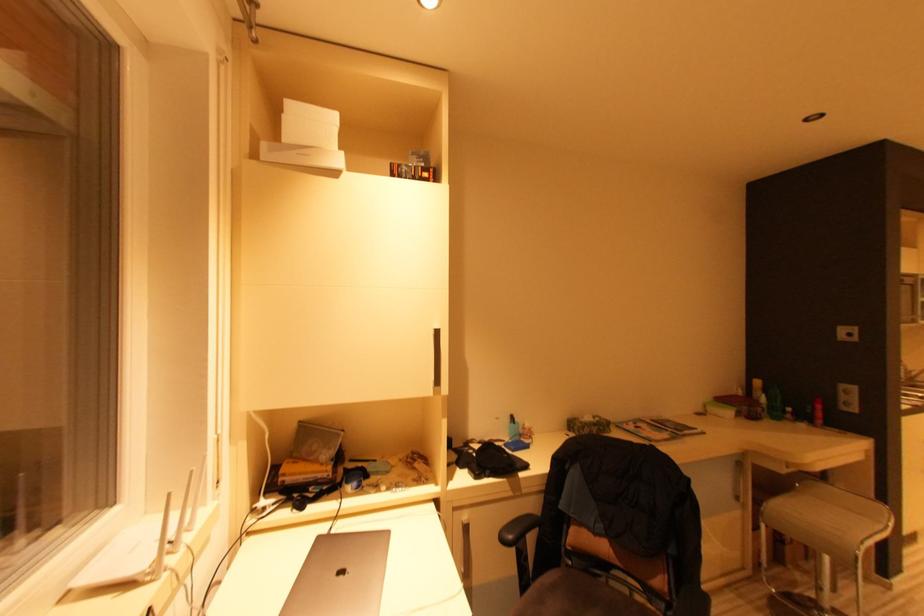
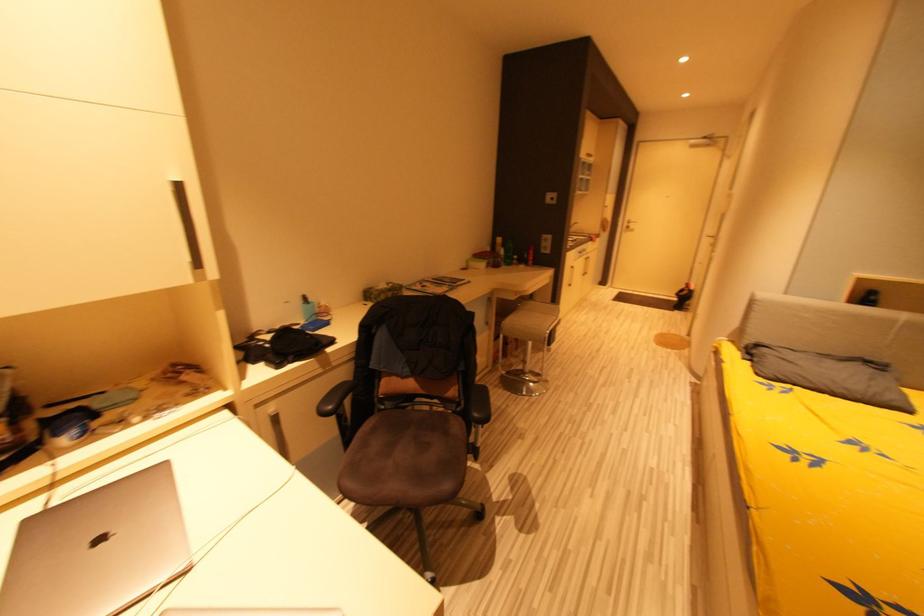
Based on the continuous images, in which direction is the camera rotating?

The rotation direction of the camera is right-down.